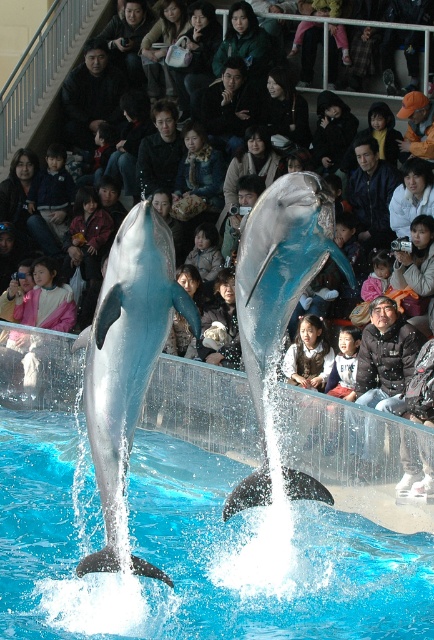
Does black textured jacket at center appear over black fabric at center?

Incorrect, black textured jacket at center is not positioned above black fabric at center.

Can you confirm if black textured jacket at center is smaller than black fabric at center?

No, black textured jacket at center is not smaller than black fabric at center.

Is point (374, 403) farther from viewer compared to point (326, 102)?

No.

Find the location of `black textured jacket at center`. black textured jacket at center is located at coordinates (385, 356).

Can you confirm if floral-patterned scarf at center is thinner than black fabric at center?

Incorrect, floral-patterned scarf at center's width is not less than black fabric at center's.

Who is more distant from viewer, (191, 180) or (332, 116)?

Positioned behind is point (191, 180).

Locate an element on the screen. The image size is (434, 640). floral-patterned scarf at center is located at coordinates (197, 176).

Is blue fabric jacket at upper center bigger than black fabric at center?

Indeed, blue fabric jacket at upper center has a larger size compared to black fabric at center.

Does point (374, 186) come behind point (349, 138)?

That is False.

Find the location of a particular element. Image resolution: width=434 pixels, height=640 pixels. blue fabric jacket at upper center is located at coordinates (371, 193).